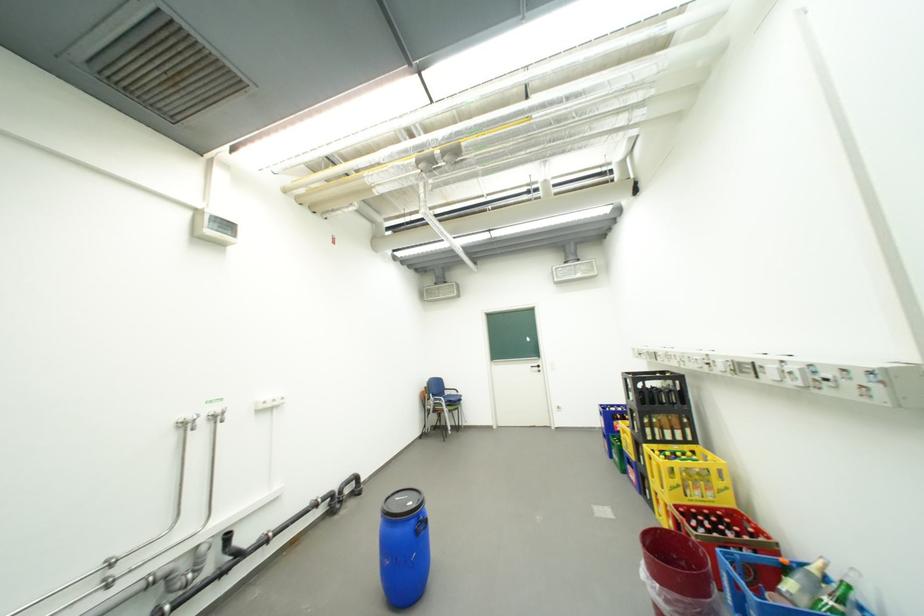
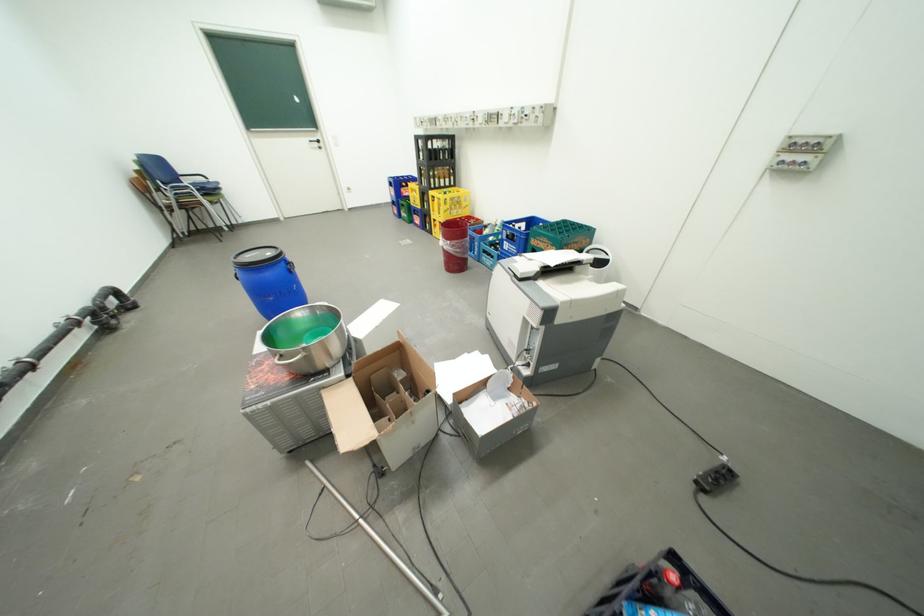
The first image is from the beginning of the video and the second image is from the end. How did the camera likely rotate when shooting the video?

The camera's rotation is toward right-down.